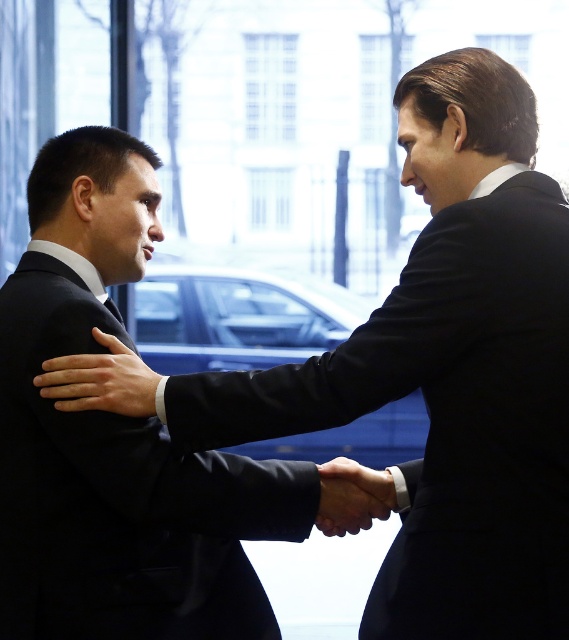
Is point (195, 564) behind point (340, 458)?

No, (195, 564) is closer to viewer.

Where is `black satin suit at left`? This screenshot has width=569, height=640. black satin suit at left is located at coordinates (121, 497).

Is point (96, 328) less distant than point (370, 474)?

Yes, it is in front of point (370, 474).

Which is in front, point (93, 387) or point (381, 515)?

Positioned in front is point (93, 387).

At what (x,y) coordinates should I click in order to perform the action: click on smooth skin hand at center. Please return your answer as a coordinate pair (x, y). Looking at the image, I should click on (101, 380).

Where is `smooth skin hand at center`? The width and height of the screenshot is (569, 640). smooth skin hand at center is located at coordinates (101, 380).

Does black satin suit at left appear under smooth skin hand at center?

Yes, black satin suit at left is below smooth skin hand at center.

Which is above, black satin suit at left or smooth skin hand at center?

Positioned higher is smooth skin hand at center.

Does point (233, 634) lie in front of point (52, 388)?

That is False.

Where is `black satin suit at left`? This screenshot has height=640, width=569. black satin suit at left is located at coordinates (121, 497).